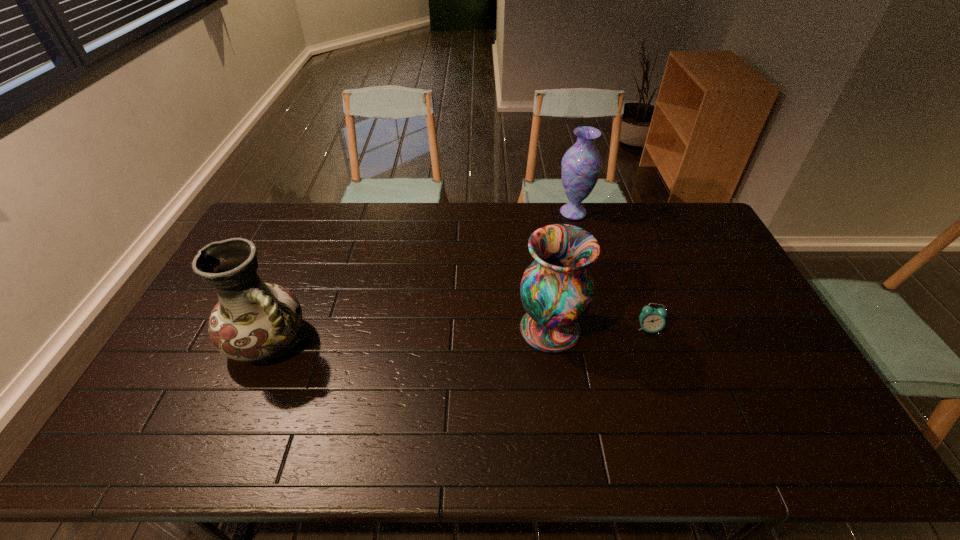
Locate an element on the screen. The image size is (960, 540). vacant space at the near edge of the desktop is located at coordinates (401, 439).

In the image, there is a desktop. Identify the location of vacant space at the right edge. Image resolution: width=960 pixels, height=540 pixels. (799, 377).

Identify the location of vacant space at the near right corner. (802, 426).

The height and width of the screenshot is (540, 960). I want to click on vacant area that lies between the leftmost object and the shortest object, so click(x=459, y=335).

This screenshot has width=960, height=540. I want to click on unoccupied area between the farthest vase and the rightmost object, so (x=611, y=271).

Identify the location of object that stands as the second closest to the farthest object. (652, 320).

Find the location of a particular element. The height and width of the screenshot is (540, 960). the second closest object to the leftmost vase is located at coordinates (581, 165).

Find the location of a particular element. The height and width of the screenshot is (540, 960). vase that can be found as the second closest to the leftmost object is located at coordinates coord(581,165).

The height and width of the screenshot is (540, 960). Identify the location of vase that is the nearest to the shortest object. (557, 290).

At what (x,y) coordinates should I click in order to perform the action: click on free location that satisfies the following two spatial constraints: 1. on the back side of the leftmost object; 2. on the right side of the farthest vase. Please return your answer as a coordinate pair (x, y). Looking at the image, I should click on (324, 213).